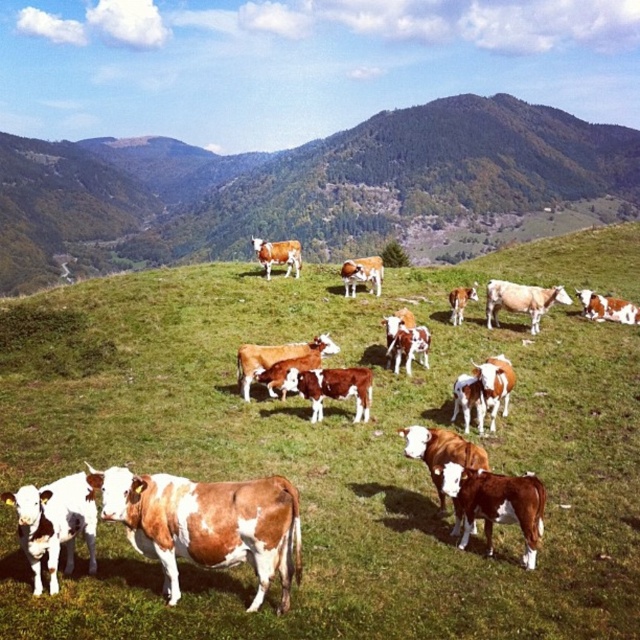
Is brown grassy hillside at center below green grassy hillside at upper center?

Yes.

How distant is brown grassy hillside at center from green grassy hillside at upper center?

brown grassy hillside at center is 61.01 meters from green grassy hillside at upper center.

Which is behind, point (216, 449) or point (396, 184)?

Positioned behind is point (396, 184).

Where is `brown grassy hillside at center`? brown grassy hillside at center is located at coordinates (332, 451).

Does brown grassy hillside at center have a greater height compared to brown speckled cow at center?

Indeed, brown grassy hillside at center has a greater height compared to brown speckled cow at center.

From the picture: Does brown grassy hillside at center appear on the right side of brown speckled cow at center?

Yes, brown grassy hillside at center is to the right of brown speckled cow at center.

Who is more forward, (x=148, y=600) or (x=272, y=252)?

Point (x=148, y=600) is in front.

In order to click on brown grassy hillside at center in this screenshot , I will do `click(332, 451)`.

Can you confirm if green grassy hillside at upper center is positioned below brown speckled cow at center?

No, green grassy hillside at upper center is not below brown speckled cow at center.

Is green grassy hillside at upper center positioned in front of brown speckled cow at center?

No.

At what (x,y) coordinates should I click in order to perform the action: click on green grassy hillside at upper center. Please return your answer as a coordinate pair (x, y). The image size is (640, 640). Looking at the image, I should click on (314, 192).

You are a GUI agent. You are given a task and a screenshot of the screen. Output one action in this format:
    pyautogui.click(x=<x>, y=<y>)
    Task: Click on the green grassy hillside at upper center
    The width and height of the screenshot is (640, 640).
    Given the screenshot: What is the action you would take?
    pyautogui.click(x=314, y=192)